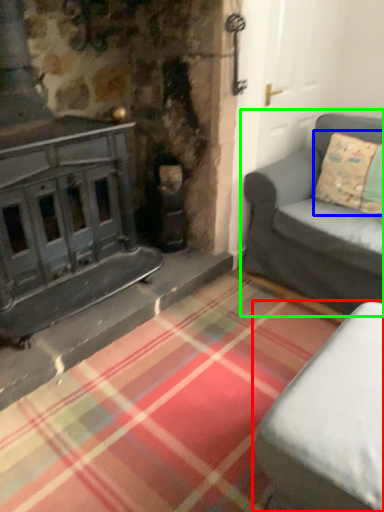
Question: Which is nearer to the studio couch (highlighted by a red box)? pillow (highlighted by a blue box) or studio couch (highlighted by a green box).

Choices:
 (A) pillow
 (B) studio couch

Answer: (B)